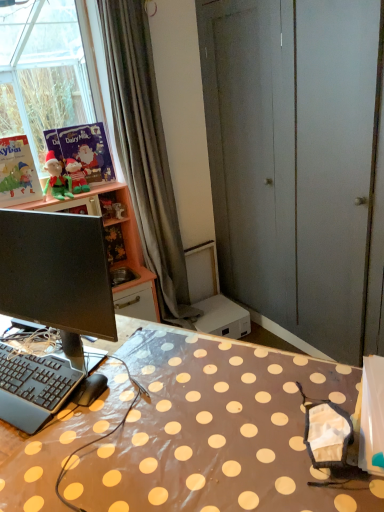
Locate an element on the screen. This screenshot has width=384, height=512. free space in front of black rubberized computer mouse at lower left is located at coordinates (78, 439).